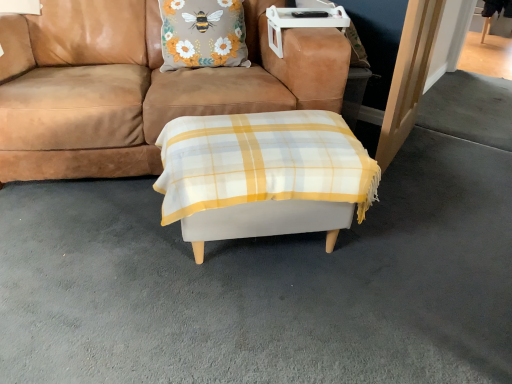
Question: Is floral fabric pillow at upper center to the right of white fabric ottoman at center from the viewer's perspective?

Choices:
 (A) no
 (B) yes

Answer: (A)

Question: Is floral fabric pillow at upper center closer to the viewer compared to white fabric ottoman at center?

Choices:
 (A) yes
 (B) no

Answer: (B)

Question: Considering the relative positions of floral fabric pillow at upper center and white fabric ottoman at center in the image provided, is floral fabric pillow at upper center behind white fabric ottoman at center?

Choices:
 (A) yes
 (B) no

Answer: (A)

Question: Is floral fabric pillow at upper center turned away from white fabric ottoman at center?

Choices:
 (A) yes
 (B) no

Answer: (B)

Question: Is floral fabric pillow at upper center smaller than white fabric ottoman at center?

Choices:
 (A) no
 (B) yes

Answer: (B)

Question: From the image's perspective, does floral fabric pillow at upper center appear lower than white fabric ottoman at center?

Choices:
 (A) yes
 (B) no

Answer: (B)

Question: Are brown suede couch at center and floral fabric pillow at upper center far apart?

Choices:
 (A) no
 (B) yes

Answer: (A)

Question: Considering the relative positions of brown suede couch at center and floral fabric pillow at upper center in the image provided, is brown suede couch at center to the right of floral fabric pillow at upper center from the viewer's perspective?

Choices:
 (A) no
 (B) yes

Answer: (A)

Question: From a real-world perspective, is brown suede couch at center under floral fabric pillow at upper center?

Choices:
 (A) no
 (B) yes

Answer: (B)

Question: Does brown suede couch at center have a smaller size compared to floral fabric pillow at upper center?

Choices:
 (A) yes
 (B) no

Answer: (B)

Question: Is brown suede couch at center looking in the opposite direction of floral fabric pillow at upper center?

Choices:
 (A) yes
 (B) no

Answer: (A)

Question: Is brown suede couch at center with floral fabric pillow at upper center?

Choices:
 (A) yes
 (B) no

Answer: (B)

Question: Does white fabric ottoman at center lie behind brown suede couch at center?

Choices:
 (A) no
 (B) yes

Answer: (A)